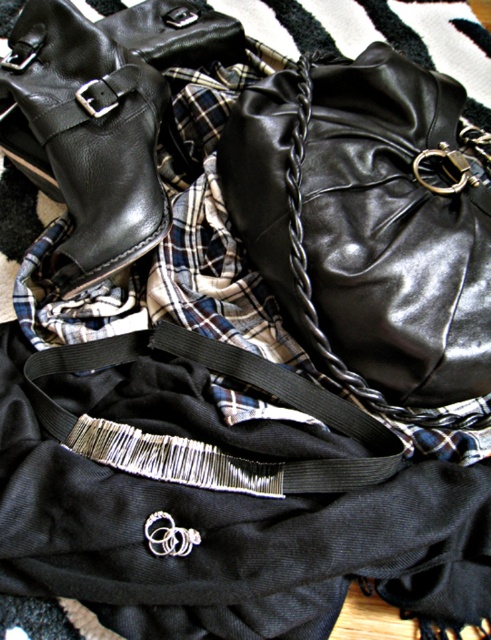
Question: Which point appears farthest from the camera in this image?

Choices:
 (A) (377, 81)
 (B) (65, 109)
 (C) (92, 365)

Answer: (C)

Question: Does glossy leather bag at upper right have a lesser width compared to shiny black leather boot at upper left?

Choices:
 (A) no
 (B) yes

Answer: (A)

Question: Which point appears farthest from the camera in this image?

Choices:
 (A) (78, 266)
 (B) (261, 163)

Answer: (A)

Question: Is the position of glossy leather bag at upper right more distant than that of shiny black leather boot at upper left?

Choices:
 (A) no
 (B) yes

Answer: (A)

Question: Observing the image, what is the correct spatial positioning of shiny black leather boot at upper left in reference to black fabric strap at center?

Choices:
 (A) left
 (B) right

Answer: (A)

Question: Considering the real-world distances, which object is closest to the shiny black leather boot at upper left?

Choices:
 (A) black fabric strap at center
 (B) glossy leather bag at upper right

Answer: (B)